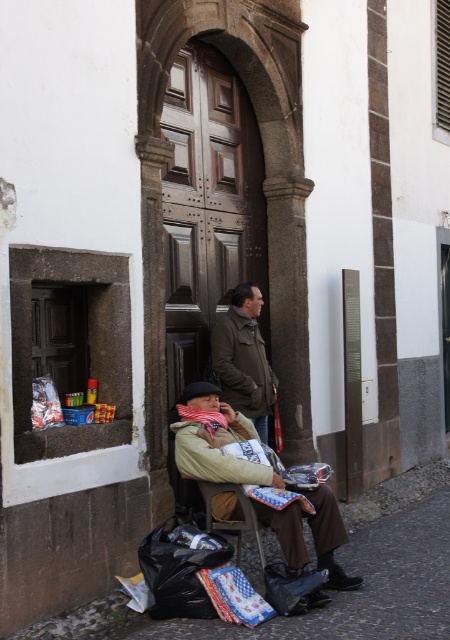
Who is shorter, brown leather trench coat at center or wooden chair at lower center?

With less height is wooden chair at lower center.

Which is in front, point (243, 404) or point (207, 504)?

Point (207, 504) is more forward.

At what (x,y) coordinates should I click in order to perform the action: click on brown leather trench coat at center. Please return your answer as a coordinate pair (x, y). The width and height of the screenshot is (450, 640). Looking at the image, I should click on (243, 356).

Which is more to the left, beige fabric jacket at lower center or wooden chair at lower center?

Positioned to the left is wooden chair at lower center.

Is beige fabric jacket at lower center further to camera compared to wooden chair at lower center?

Yes, it is.

Is point (319, 512) closer to camera compared to point (242, 531)?

No, it is behind (242, 531).

At what (x,y) coordinates should I click in order to perform the action: click on beige fabric jacket at lower center. Please return your answer as a coordinate pair (x, y). This screenshot has width=450, height=640. Looking at the image, I should click on (215, 440).

Does beige fabric jacket at lower center have a lesser width compared to brown leather trench coat at center?

Incorrect, beige fabric jacket at lower center's width is not less than brown leather trench coat at center's.

Is beige fabric jacket at lower center to the right of brown leather trench coat at center from the viewer's perspective?

Indeed, beige fabric jacket at lower center is positioned on the right side of brown leather trench coat at center.

Who is more distant from viewer, (x=307, y=520) or (x=257, y=330)?

The point (x=257, y=330) is behind.

Where is `beige fabric jacket at lower center`? beige fabric jacket at lower center is located at coordinates (215, 440).